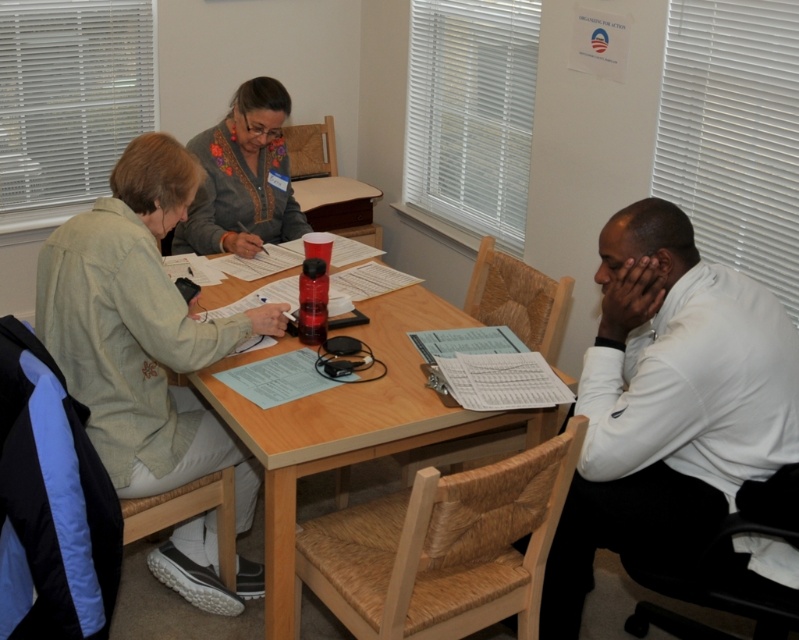
Who is higher up, white shirt at right or wooden table at center?

Positioned higher is wooden table at center.

Image resolution: width=799 pixels, height=640 pixels. What are the coordinates of `white shirt at right` in the screenshot? It's located at (668, 403).

Is point (615, 352) less distant than point (292, 506)?

No, (615, 352) is further to viewer.

Locate an element on the screen. white shirt at right is located at coordinates (668, 403).

Does white shirt at right appear over knitted gray sweater at center?

No.

Measure the distance between point (690, 273) and camera.

Point (690, 273) is 1.82 meters from camera.

Who is more distant from viewer, (638, 492) or (255, 129)?

Positioned behind is point (255, 129).

This screenshot has height=640, width=799. In order to click on white shirt at right in this screenshot , I will do `click(668, 403)`.

Is wooden table at center behind knitted gray sweater at center?

No.

Consider the image. Can you confirm if wooden table at center is positioned to the right of knitted gray sweater at center?

Yes, wooden table at center is to the right of knitted gray sweater at center.

Image resolution: width=799 pixels, height=640 pixels. In order to click on wooden table at center in this screenshot , I will do `click(364, 428)`.